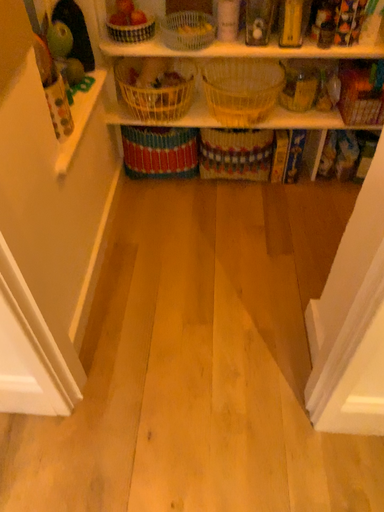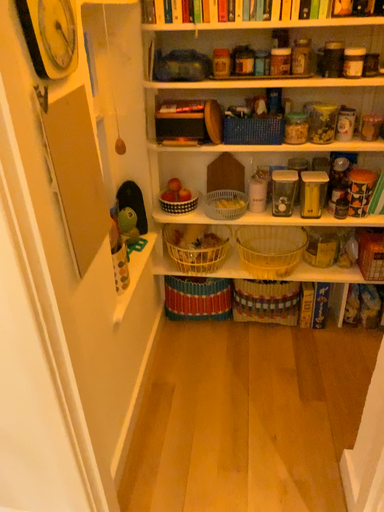
Question: How did the camera likely rotate when shooting the video?

Choices:
 (A) rotated downward
 (B) rotated upward

Answer: (B)